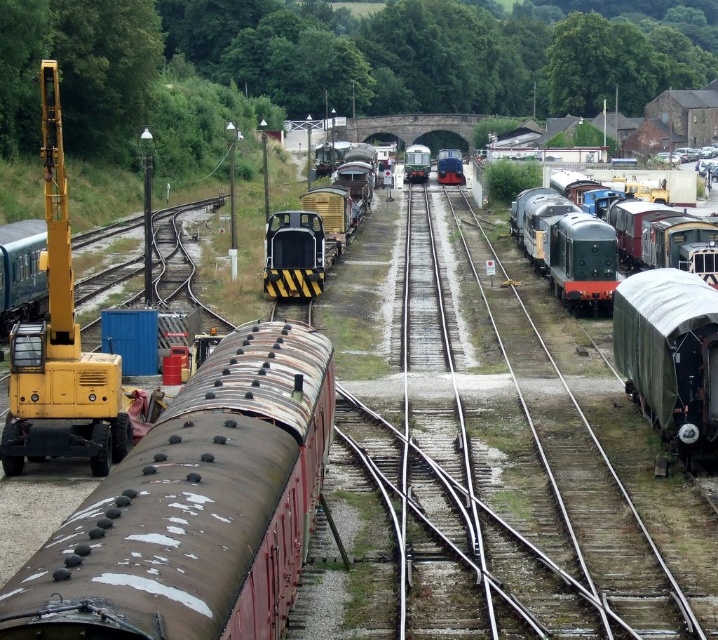
Consider the image. Is green matte train at right further to the viewer compared to green polished wood train at center?

No, it is in front of green polished wood train at center.

Does point (666, 221) come behind point (411, 172)?

No, (666, 221) is in front of (411, 172).

This screenshot has height=640, width=718. In order to click on green matte train at right in this screenshot , I will do `click(668, 324)`.

Does green polished metal train car at right have a lesser width compared to polished dark blue locomotive at center?

Yes, green polished metal train car at right is thinner than polished dark blue locomotive at center.

Consider the image. Does green polished metal train car at right have a larger size compared to polished dark blue locomotive at center?

No.

Is point (567, 298) positioned before point (460, 163)?

Yes, it is in front of point (460, 163).

Locate an element on the screen. This screenshot has width=718, height=640. green polished metal train car at right is located at coordinates (579, 259).

Can you confirm if green polished metal train car at right is positioned below green polished wood train at center?

Yes, green polished metal train car at right is below green polished wood train at center.

Image resolution: width=718 pixels, height=640 pixels. Identify the location of green polished metal train car at right. (579, 259).